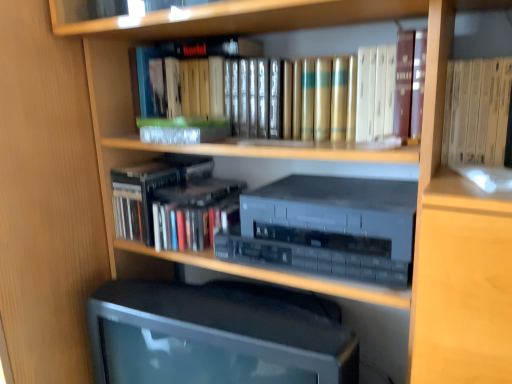
Find the location of a particular element. This screenshot has width=512, height=384. free space above gold leather book at center, the first book viewed from the top (from a real-world perspective) is located at coordinates click(x=264, y=57).